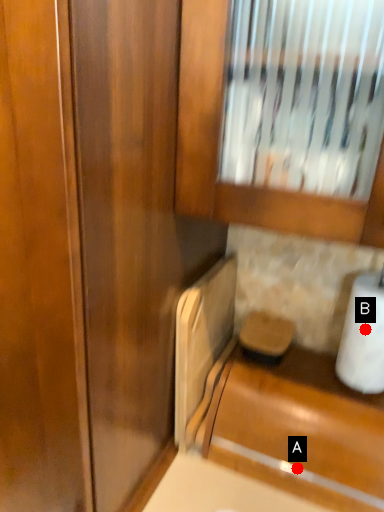
Question: Two points are circled on the image, labeled by A and B beside each circle. Which point is farther from the camera taking this photo?

Choices:
 (A) A is further
 (B) B is further

Answer: (A)